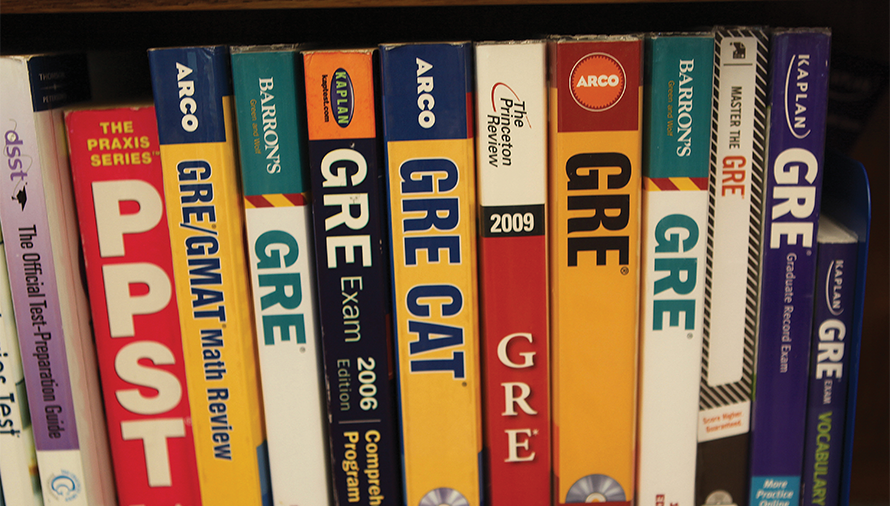
Identify the location of black book. The height and width of the screenshot is (506, 890). (373, 278).